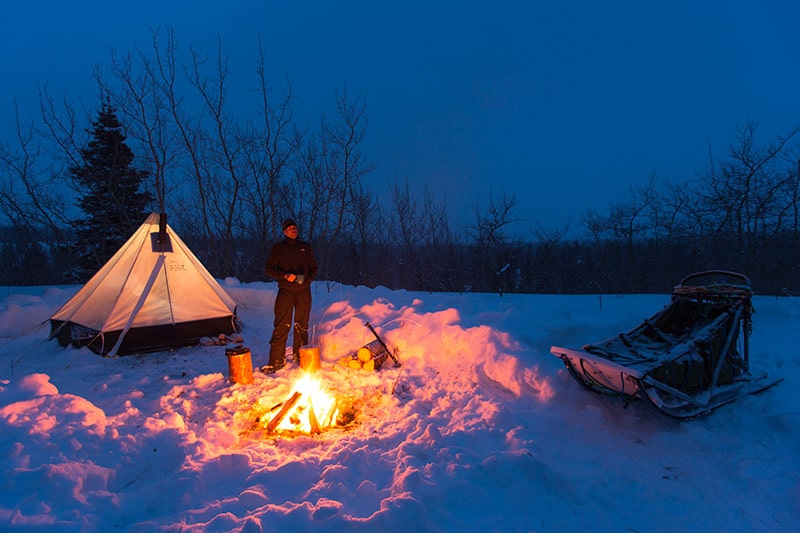
You are a GUI agent. You are given a task and a screenshot of the screen. Output one action in this format:
    pyautogui.click(x=<x>, y=<y>)
    Task: Click on the mug
    The image size is (800, 533).
    Given the screenshot: What is the action you would take?
    (x=298, y=277)